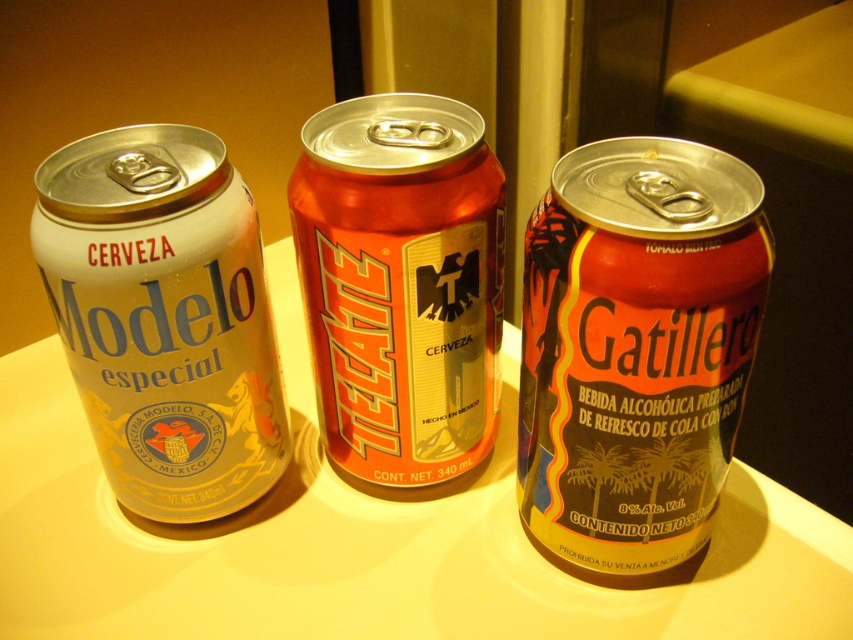
Question: Does shiny metallic can at center appear on the left side of orange metallic can at center?

Choices:
 (A) no
 (B) yes

Answer: (A)

Question: Which point is farther to the camera?

Choices:
 (A) (442, 230)
 (B) (531, 284)

Answer: (A)

Question: Does shiny metallic can at center have a lesser width compared to orange metallic can at center?

Choices:
 (A) yes
 (B) no

Answer: (A)

Question: Considering the real-world distances, which object is farthest from the shiny metallic can at center?

Choices:
 (A) orange metallic can at center
 (B) silver metallic can at left

Answer: (B)

Question: Among these points, which one is nearest to the camera?

Choices:
 (A) (68, 321)
 (B) (579, 451)

Answer: (B)

Question: Does silver metallic can at left appear on the right side of orange metallic can at center?

Choices:
 (A) no
 (B) yes

Answer: (A)